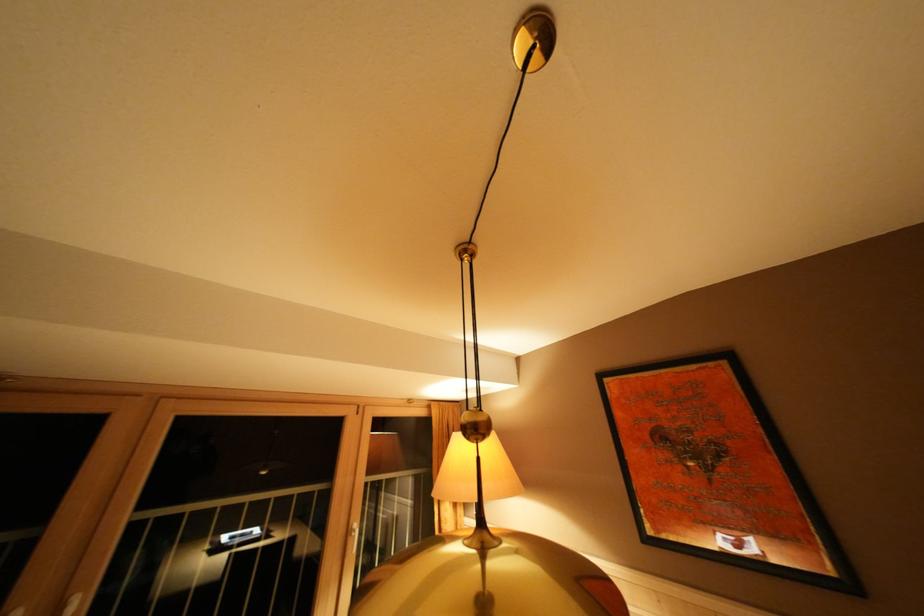
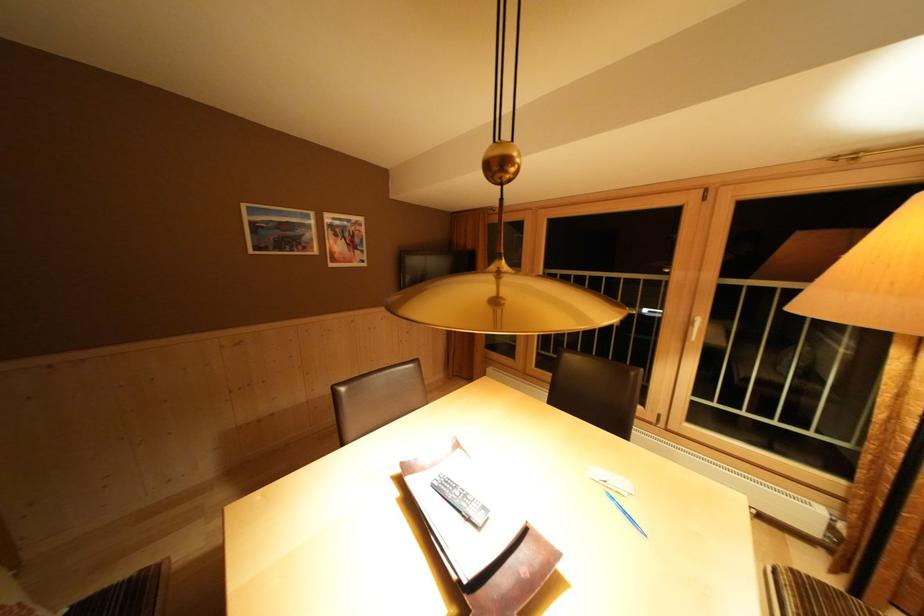
Question: The camera is either moving clockwise (left) or counter-clockwise (right) around the object. The first image is from the beginning of the video and the second image is from the end. Is the camera moving left or right when shooting the video?

Choices:
 (A) Left
 (B) Right

Answer: (B)